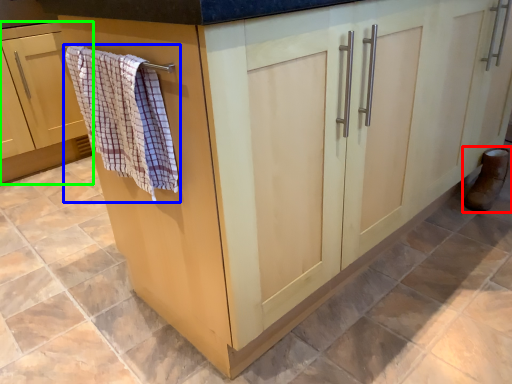
Question: Which object is positioned farthest from footwear (highlighted by a red box)? Select from bath towel (highlighted by a blue box) and cabinetry (highlighted by a green box).

Choices:
 (A) bath towel
 (B) cabinetry

Answer: (B)